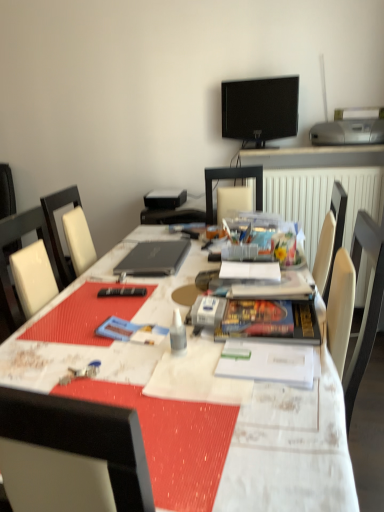
Question: Is point (180, 330) positioned closer to the camera than point (97, 330)?

Choices:
 (A) closer
 (B) farther

Answer: (A)

Question: Is white plastic glue at center wider or thinner than blue matte paperback book at center, arranged as the second paperback book when viewed from the right?

Choices:
 (A) thin
 (B) wide

Answer: (A)

Question: Which of these objects is positioned closest to the white plastic glue at center?

Choices:
 (A) white textured table at center
 (B) hardcover book at center, arranged as the second paperback book when viewed from the left
 (C) black matte laptop at center
 (D) black glossy tv at upper center
 (E) blue matte paperback book at center, which ranks as the 1th paperback book in left-to-right order

Answer: (E)

Question: Considering the real-world distances, which object is farthest from the white textured table at center?

Choices:
 (A) white plastic glue at center
 (B) black glossy tv at upper center
 (C) silver metallic printer at upper right
 (D) blue matte paperback book at center, arranged as the second paperback book when viewed from the right
 (E) black matte laptop at center

Answer: (C)